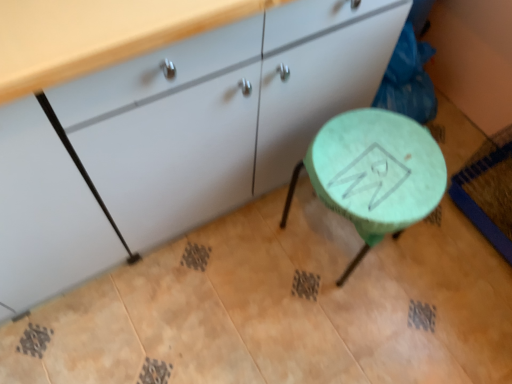
Question: Is green matte stool at center taller or shorter than matte white cabinet at center?

Choices:
 (A) tall
 (B) short

Answer: (B)

Question: From the image's perspective, relative to matte white cabinet at center, is green matte stool at center above or below?

Choices:
 (A) above
 (B) below

Answer: (B)

Question: Is green matte stool at center inside or outside of matte white cabinet at center?

Choices:
 (A) inside
 (B) outside

Answer: (B)

Question: Considering the positions of matte white cabinet at center and green matte stool at center in the image, is matte white cabinet at center bigger or smaller than green matte stool at center?

Choices:
 (A) big
 (B) small

Answer: (A)

Question: From a real-world perspective, relative to green matte stool at center, is matte white cabinet at center vertically above or below?

Choices:
 (A) above
 (B) below

Answer: (A)

Question: From their relative heights in the image, would you say matte white cabinet at center is taller or shorter than green matte stool at center?

Choices:
 (A) tall
 (B) short

Answer: (A)

Question: From the image's perspective, relative to green matte stool at center, is matte white cabinet at center above or below?

Choices:
 (A) below
 (B) above

Answer: (B)